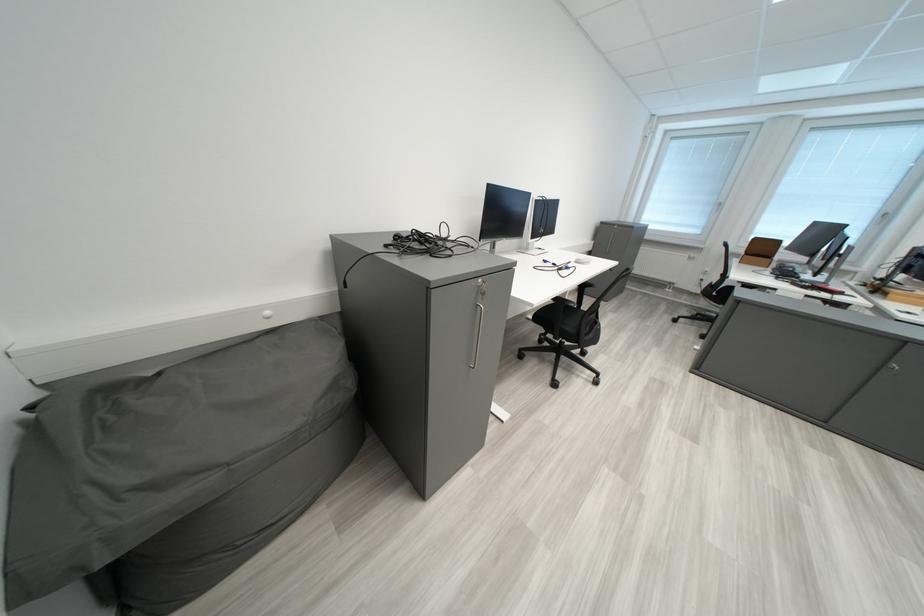
Where is `cabinet key`? The width and height of the screenshot is (924, 616). cabinet key is located at coordinates (891, 370).